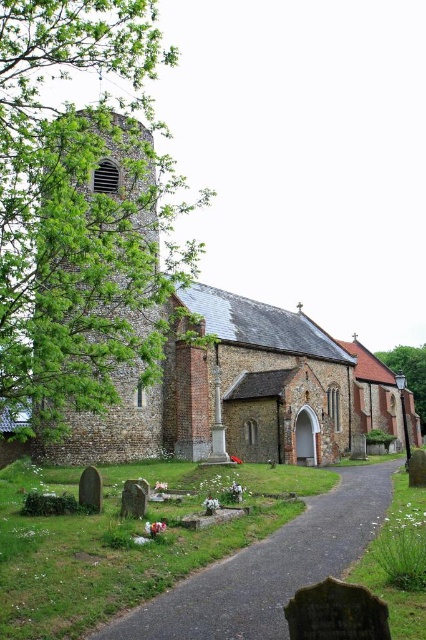
Question: Which object is positioned farthest from the light brown stone tower at left?

Choices:
 (A) green leafy tree at left
 (B) gravel pathway at center
 (C) green leafy tree at center

Answer: (C)

Question: Which of the following is the farthest from the observer?

Choices:
 (A) brown brick church at center
 (B) gravel pathway at center
 (C) green leafy tree at center
 (D) green leafy tree at left

Answer: (C)

Question: Can you confirm if light brown stone tower at left is positioned above gravel pathway at center?

Choices:
 (A) no
 (B) yes

Answer: (B)

Question: Is brown brick church at center wider than light brown stone tower at left?

Choices:
 (A) no
 (B) yes

Answer: (B)

Question: Which of the following is the closest to the observer?

Choices:
 (A) (115, 67)
 (B) (131, 620)

Answer: (B)

Question: Is green leafy tree at left bigger than gravel pathway at center?

Choices:
 (A) no
 (B) yes

Answer: (B)